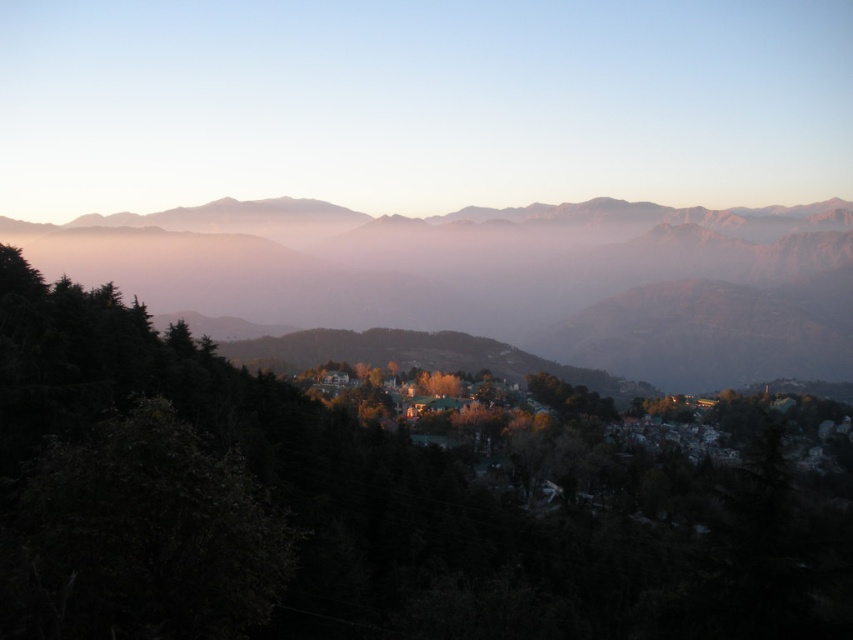
Does green matte tree at center lie behind gray rocky mountain range at center?

No, green matte tree at center is in front of gray rocky mountain range at center.

Can you confirm if green matte tree at center is smaller than gray rocky mountain range at center?

Correct, green matte tree at center occupies less space than gray rocky mountain range at center.

Where is `green matte tree at center`? green matte tree at center is located at coordinates (366, 506).

From the picture: Is the position of green matte tree at center more distant than that of pastel pink mountains at upper center?

No, it is not.

Who is positioned more to the left, green matte tree at center or pastel pink mountains at upper center?

From the viewer's perspective, pastel pink mountains at upper center appears more on the left side.

Which is in front, point (270, 394) or point (538, 129)?

Point (270, 394) is in front.

Locate an element on the screen. This screenshot has width=853, height=640. green matte tree at center is located at coordinates (366, 506).

Is pastel pink mountains at upper center smaller than gray rocky mountain range at center?

Correct, pastel pink mountains at upper center occupies less space than gray rocky mountain range at center.

From the picture: Who is lower down, pastel pink mountains at upper center or gray rocky mountain range at center?

Positioned lower is gray rocky mountain range at center.

What do you see at coordinates (421, 104) in the screenshot? The image size is (853, 640). I see `pastel pink mountains at upper center` at bounding box center [421, 104].

Image resolution: width=853 pixels, height=640 pixels. In order to click on pastel pink mountains at upper center in this screenshot , I will do `click(421, 104)`.